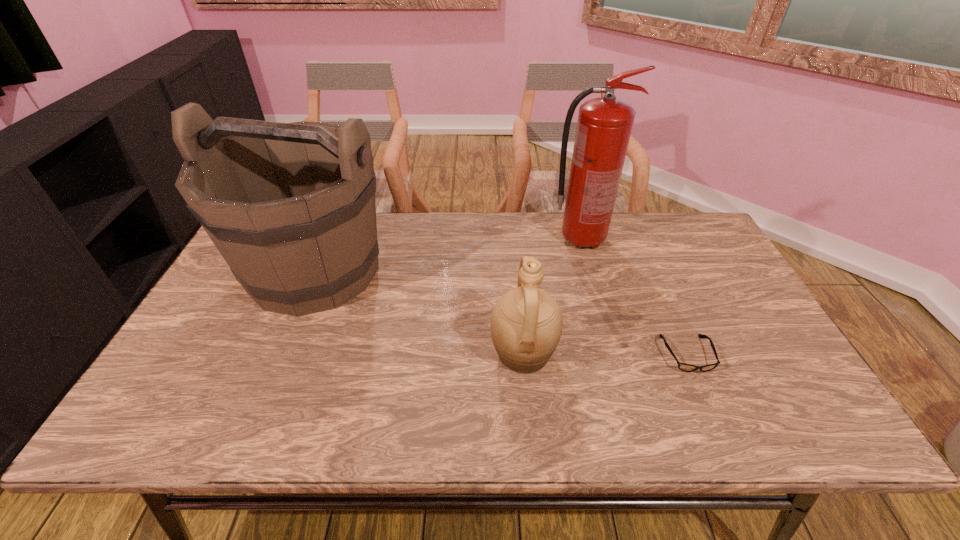
Locate an element on the screen. fire extinguisher that is at the far edge is located at coordinates (604, 125).

Identify the location of bucket at the far edge. (291, 207).

Where is `object present at the left edge`? The width and height of the screenshot is (960, 540). object present at the left edge is located at coordinates (291, 207).

Identify the location of object present at the far left corner. This screenshot has width=960, height=540. (291, 207).

Where is `vacant space at the far edge of the desktop`? The height and width of the screenshot is (540, 960). vacant space at the far edge of the desktop is located at coordinates (455, 251).

You are a GUI agent. You are given a task and a screenshot of the screen. Output one action in this format:
    pyautogui.click(x=<x>, y=<y>)
    Task: Click on the vacant space at the near edge
    Image resolution: width=960 pixels, height=540 pixels.
    Given the screenshot: What is the action you would take?
    pyautogui.click(x=488, y=436)

In the image, there is a desktop. In order to click on vacant space at the left edge in this screenshot , I will do `click(156, 398)`.

Locate an element on the screen. The image size is (960, 540). free location at the right edge of the desktop is located at coordinates (704, 323).

Locate an element on the screen. vacant space at the far right corner of the desktop is located at coordinates (665, 218).

Image resolution: width=960 pixels, height=540 pixels. I want to click on vacant area that lies between the pitcher and the shortest object, so click(x=605, y=354).